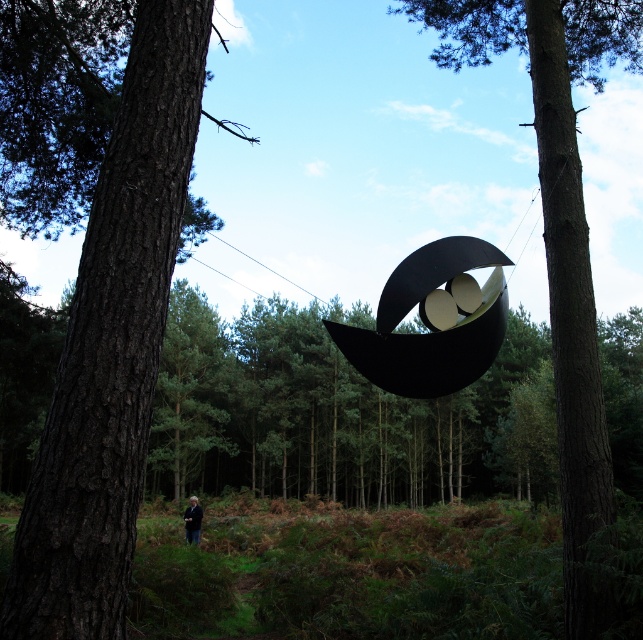
Can you confirm if dark brown textured tree trunk at left is smaller than smooth brown tree trunk at center?

Correct, dark brown textured tree trunk at left occupies less space than smooth brown tree trunk at center.

Can you confirm if dark brown textured tree trunk at left is wider than smooth brown tree trunk at center?

Yes.

Does point (111, 104) come behind point (579, 304)?

Yes, it is behind point (579, 304).

This screenshot has height=640, width=643. What are the coordinates of `dark brown textured tree trunk at left` in the screenshot? It's located at (96, 275).

Can you confirm if smooth brown tree trunk at center is wider than black fabric person at lower center?

Yes.

Consider the image. How far apart are smooth brown tree trunk at center and black fabric person at lower center?

11.22 meters

Is point (572, 321) closer to viewer compared to point (186, 522)?

Yes, it is in front of point (186, 522).

What are the coordinates of `smooth brown tree trunk at center` in the screenshot? It's located at (561, 252).

Image resolution: width=643 pixels, height=640 pixels. What do you see at coordinates (96, 275) in the screenshot?
I see `dark brown textured tree trunk at left` at bounding box center [96, 275].

This screenshot has width=643, height=640. What are the coordinates of `dark brown textured tree trunk at left` in the screenshot? It's located at (96, 275).